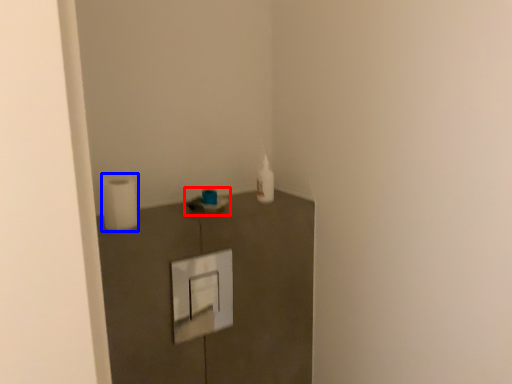
Question: Among these objects, which one is nearest to the camera, sink (highlighted by a red box) or toilet paper (highlighted by a blue box)?

Choices:
 (A) sink
 (B) toilet paper

Answer: (B)